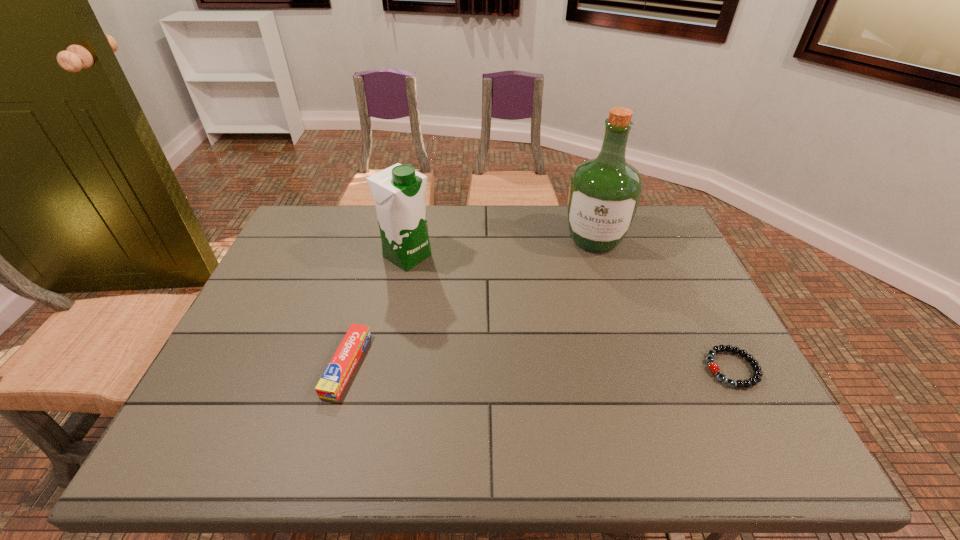
I want to click on object that is the third closest to the tallest object, so click(333, 381).

This screenshot has height=540, width=960. What are the coordinates of `blank area in the image that satisfies the following two spatial constraints: 1. on the back side of the third object from left to right; 2. on the right side of the soya milk` in the screenshot? It's located at (411, 240).

Identify the location of free point that satisfies the following two spatial constraints: 1. on the back side of the third object from left to right; 2. on the right side of the second tallest object. (411, 240).

Locate an element on the screen. free spot that satisfies the following two spatial constraints: 1. on the back side of the soya milk; 2. on the left side of the second shortest object is located at coordinates click(x=376, y=256).

Identify the location of vacant space that satisfies the following two spatial constraints: 1. on the back side of the toothpaste; 2. on the right side of the second tallest object. The height and width of the screenshot is (540, 960). (376, 256).